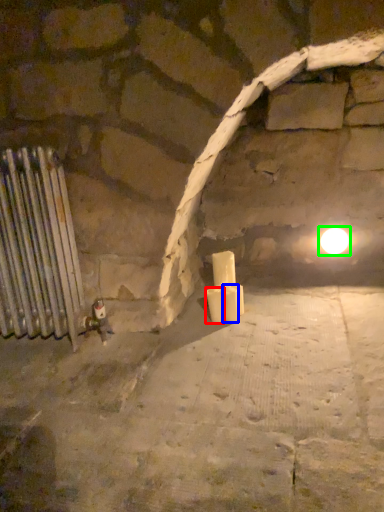
Question: Which object is positioned farthest from candle (highlighted by a red box)? Select from candle (highlighted by a blue box) and light (highlighted by a green box).

Choices:
 (A) candle
 (B) light

Answer: (B)